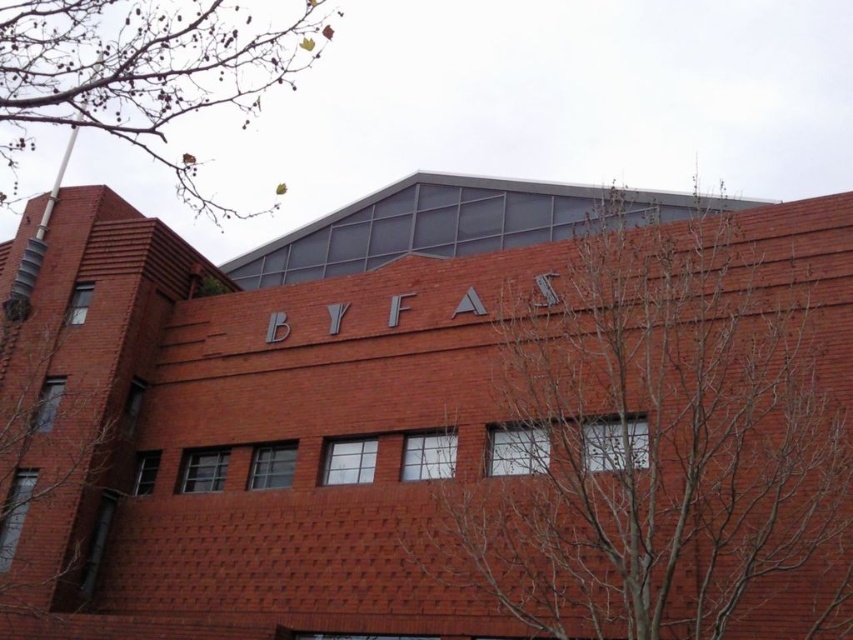
Question: Which of the following is the farthest from the observer?

Choices:
 (A) bare branches at left
 (B) bare branches at center

Answer: (A)

Question: Which point is closer to the camera taking this photo?

Choices:
 (A) (28, 464)
 (B) (10, 1)
 (C) (515, 499)

Answer: (C)

Question: Where is brown leafy tree at upper left located in relation to bare branches at left in the image?

Choices:
 (A) above
 (B) below

Answer: (A)

Question: Is bare branches at center thinner than brown leafy tree at upper left?

Choices:
 (A) yes
 (B) no

Answer: (A)

Question: Can you confirm if bare branches at center is positioned above bare branches at left?

Choices:
 (A) no
 (B) yes

Answer: (B)

Question: Among these objects, which one is nearest to the camera?

Choices:
 (A) bare branches at left
 (B) brown leafy tree at upper left

Answer: (B)